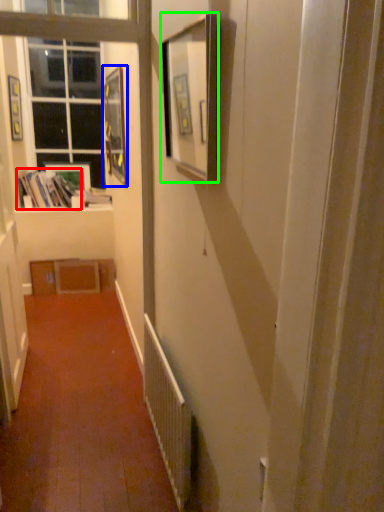
Question: Which object is positioned closest to book (highlighted by a red box)? Select from picture frame (highlighted by a blue box) and picture frame (highlighted by a green box).

Choices:
 (A) picture frame
 (B) picture frame

Answer: (A)